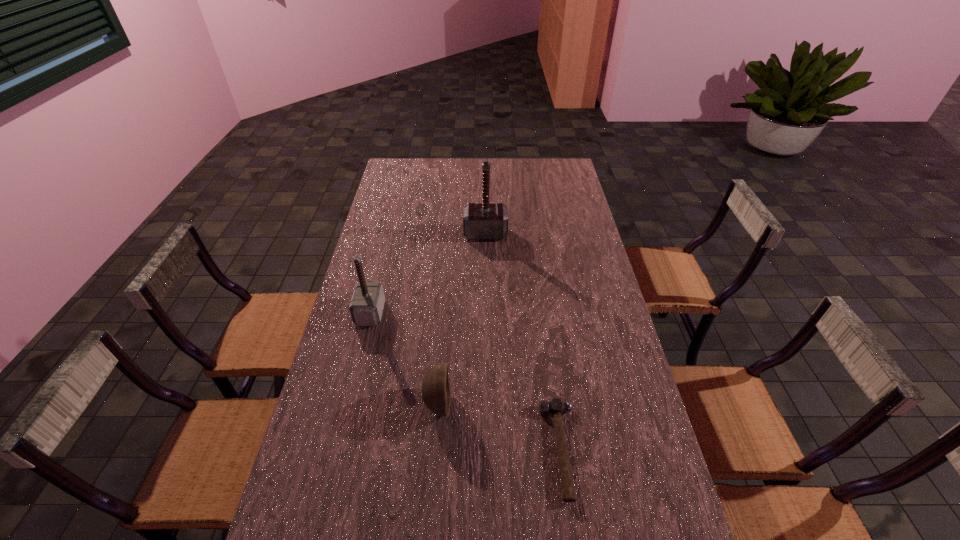
I want to click on vacant space located on the back of the third tallest object, so click(447, 288).

Identify the location of vacant space located on the striking face of the rightmost object. The width and height of the screenshot is (960, 540). (402, 450).

Where is `vacant space located on the striking face of the rightmost object`? The image size is (960, 540). vacant space located on the striking face of the rightmost object is located at coordinates (468, 450).

At what (x,y) coordinates should I click in order to perform the action: click on vacant space located 0.380m on the striking face of the rightmost object. Please return your answer as a coordinate pair (x, y). Looking at the image, I should click on (395, 450).

This screenshot has width=960, height=540. Identify the location of object that is at the left edge. (366, 307).

Where is `vacant space at the far edge of the desktop`? This screenshot has width=960, height=540. vacant space at the far edge of the desktop is located at coordinates (523, 178).

In the image, there is a desktop. At what (x,y) coordinates should I click in order to perform the action: click on blank space at the left edge. Please return your answer as a coordinate pair (x, y). The width and height of the screenshot is (960, 540). Looking at the image, I should click on (362, 348).

Identify the location of vacant space at the right edge. (567, 277).

This screenshot has width=960, height=540. I want to click on free spot between the second object from left to right and the farthest object, so click(x=462, y=319).

Locate an element on the screen. The width and height of the screenshot is (960, 540). free space between the second tallest hammer and the second object from right to left is located at coordinates (428, 273).